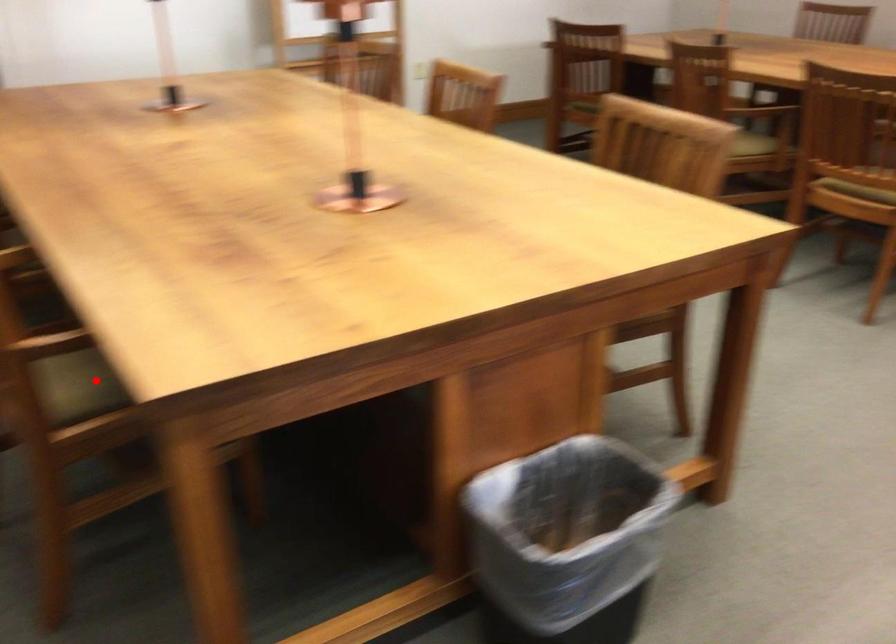
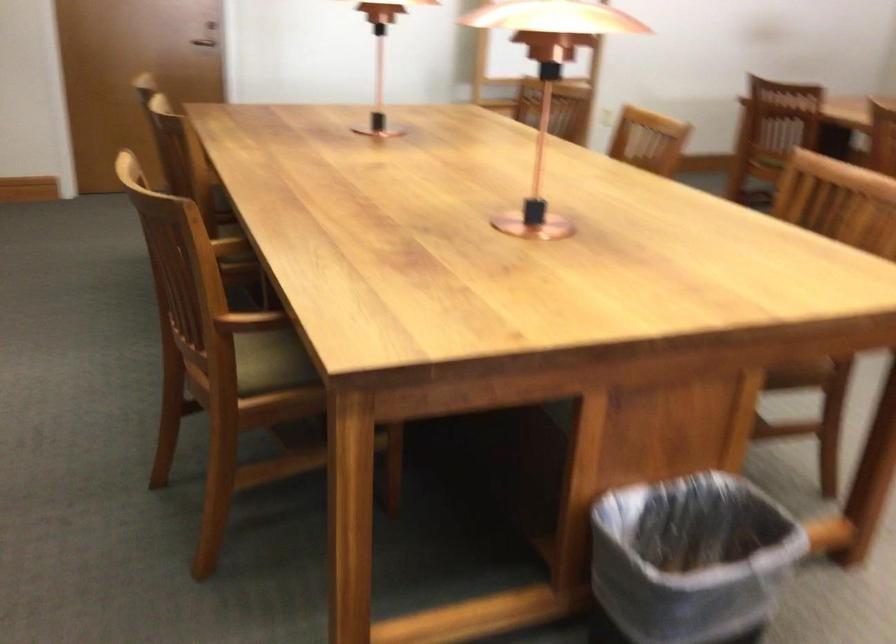
Where in the second image is the point corresponding to the highlighted location from the first image?

(271, 362)